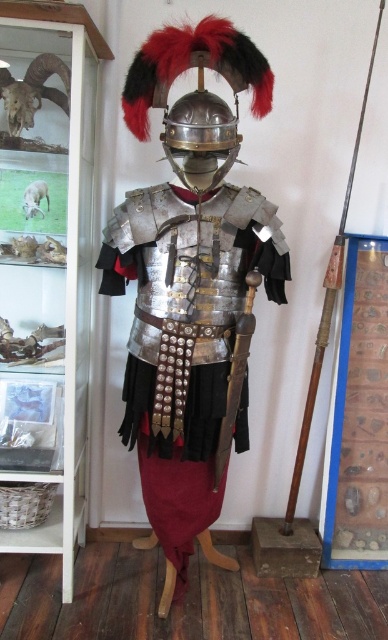
You are a museum security guard who needs to check the distance between the shiny silver helmet at center and the white fur sheep at center. According to the museum guidelines, the minimum safe distance between these two items should be 25 inches to prevent accidental collisions. Is the current distance compliant with the guidelines?

The shiny silver helmet at center and the white fur sheep at center are 27.43 inches apart from each other, which exceeds the minimum required distance of 25 inches. Therefore, the current distance is compliant with the museum guidelines.

From the picture: You are a museum visitor standing in front of the display. You see the wooden shaft spear at right and the white fur sheep at center. Which object is positioned to the right of the other?

The wooden shaft spear at right is to the right of the white fur sheep at center.

You are a museum visitor standing in front of the Roman armor display. The display includes a full suit of armor and a spear. There is a point marked at coordinates point (228, 301). Can you estimate how far this point is from your current position?

The point (228, 301) is 6.29 feet away from the camera, so it is approximately 6.29 feet away from your current position.